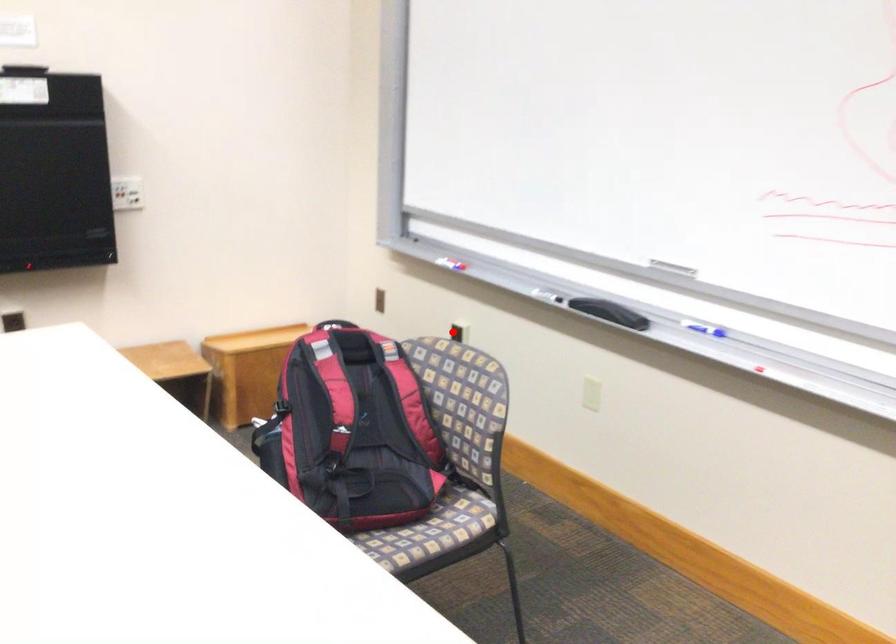
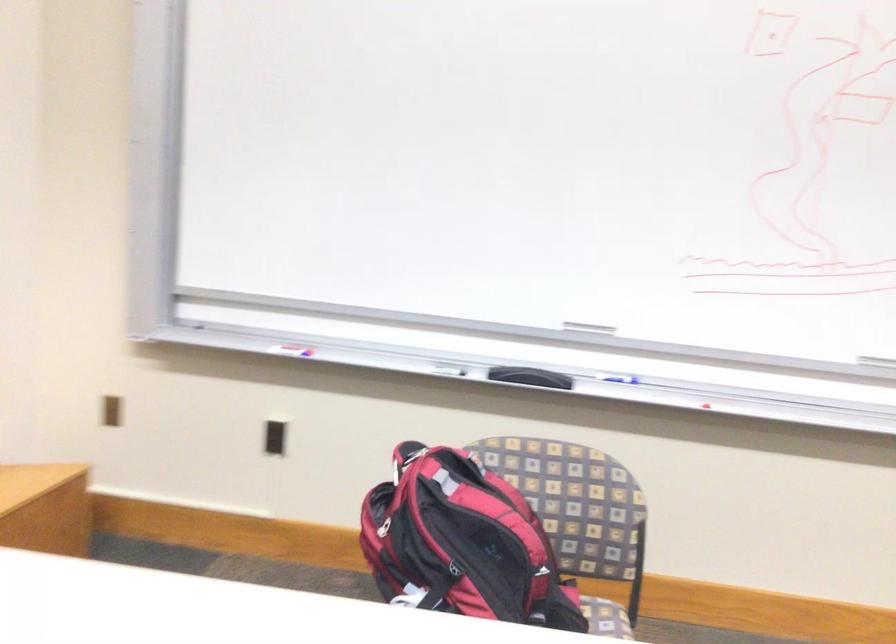
Question: I am providing you with two images of the same scene from different viewpoints. A red point is shown in image1. For the corresponding object point in image2, is it positioned nearer or farther from the camera?

Choices:
 (A) Nearer
 (B) Farther

Answer: (A)